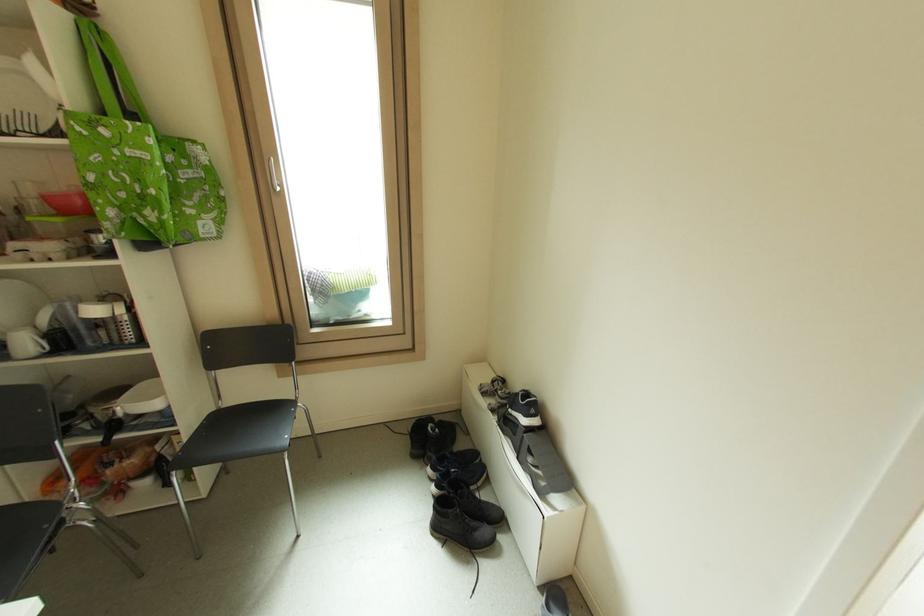
The image size is (924, 616). I want to click on frying pan handle, so click(112, 431).